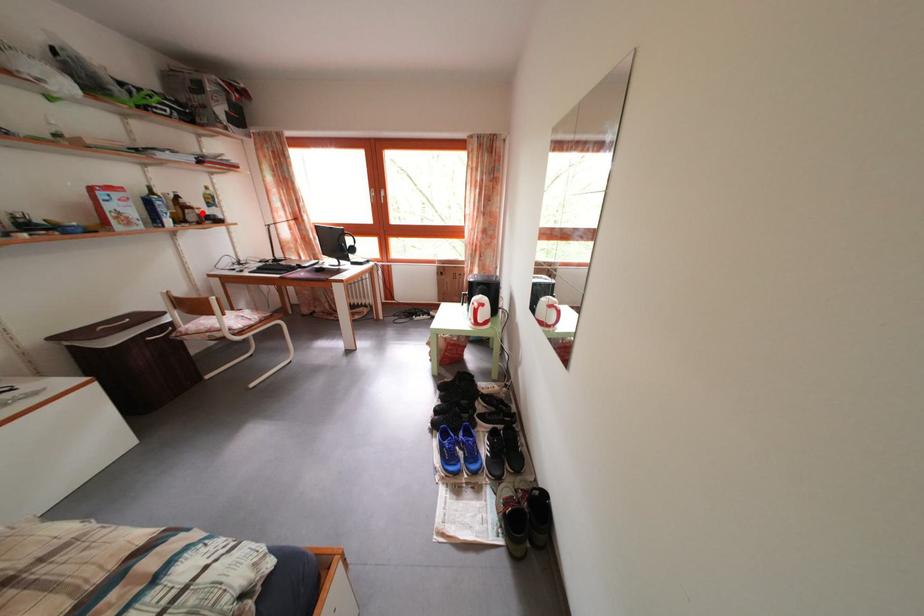
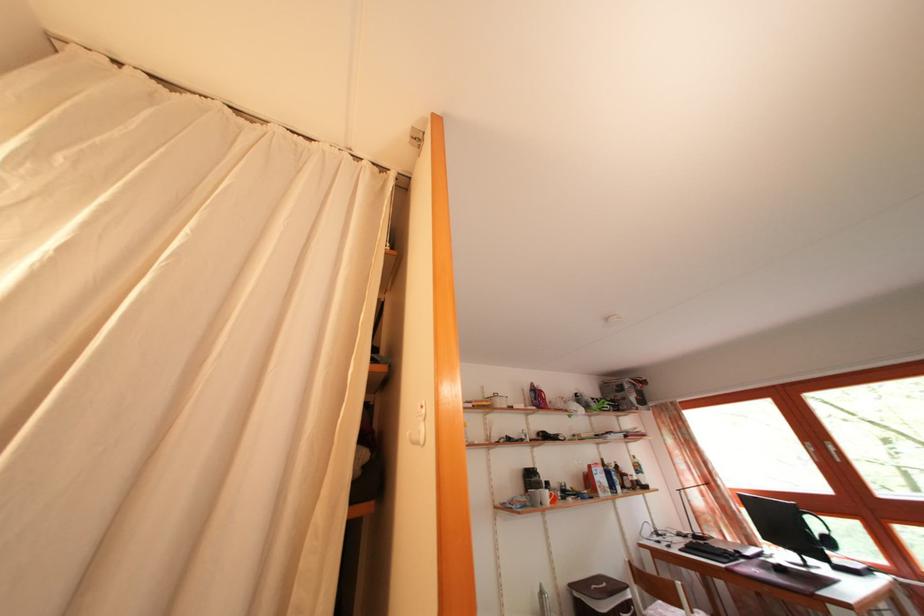
Question: I am providing you with two images of the same scene from different viewpoints. In image1, a red point is highlighted. Considering the same 3D point in image2, which of the following is correct?

Choices:
 (A) It is closer
 (B) It is farther

Answer: (B)